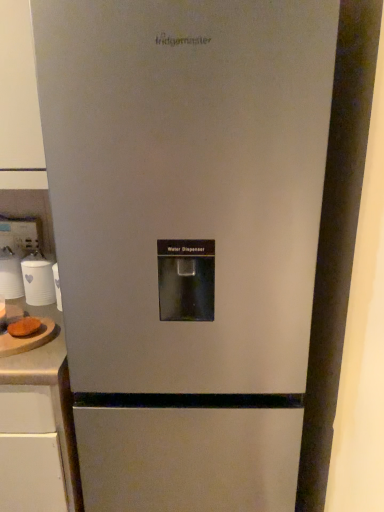
Question: Does white laminate counter at lower left, which ranks as the 2th counter top in top-to-bottom order, have a smaller size compared to white matte cup at left, positioned as the 2th appliance in left-to-right order?

Choices:
 (A) no
 (B) yes

Answer: (A)

Question: From a real-world perspective, is white laminate counter at lower left, which ranks as the 2th counter top in top-to-bottom order, positioned under white matte cup at left, positioned as the 2th appliance in left-to-right order, based on gravity?

Choices:
 (A) no
 (B) yes

Answer: (B)

Question: Does white laminate counter at lower left, marked as the 1th counter top in a bottom-to-top arrangement, lie in front of white matte cup at left, positioned as the 2th appliance in left-to-right order?

Choices:
 (A) no
 (B) yes

Answer: (B)

Question: From a real-world perspective, is white laminate counter at lower left, which ranks as the 2th counter top in top-to-bottom order, positioned over white matte cup at left, which is the first appliance from right to left, based on gravity?

Choices:
 (A) no
 (B) yes

Answer: (A)

Question: Considering the relative positions of white laminate counter at lower left, marked as the 1th counter top in a bottom-to-top arrangement, and white matte cup at left, positioned as the 2th appliance in left-to-right order, in the image provided, is white laminate counter at lower left, marked as the 1th counter top in a bottom-to-top arrangement, to the right of white matte cup at left, positioned as the 2th appliance in left-to-right order, from the viewer's perspective?

Choices:
 (A) no
 (B) yes

Answer: (A)

Question: Visually, is white laminate counter at lower left, marked as the 1th counter top in a bottom-to-top arrangement, positioned to the left or to the right of brown fuzzy bread at left?

Choices:
 (A) right
 (B) left

Answer: (B)

Question: In terms of size, does white laminate counter at lower left, which ranks as the 2th counter top in top-to-bottom order, appear bigger or smaller than brown fuzzy bread at left?

Choices:
 (A) small
 (B) big

Answer: (B)

Question: Considering their positions, is white laminate counter at lower left, marked as the 1th counter top in a bottom-to-top arrangement, located in front of or behind brown fuzzy bread at left?

Choices:
 (A) front
 (B) behind

Answer: (A)

Question: Considering the positions of white laminate counter at lower left, marked as the 1th counter top in a bottom-to-top arrangement, and brown fuzzy bread at left in the image, is white laminate counter at lower left, marked as the 1th counter top in a bottom-to-top arrangement, wider or thinner than brown fuzzy bread at left?

Choices:
 (A) thin
 (B) wide

Answer: (B)

Question: Looking at the image, does brown fuzzy bread at left seem bigger or smaller compared to white laminate counter at lower left, which ranks as the 2th counter top in top-to-bottom order?

Choices:
 (A) small
 (B) big

Answer: (A)

Question: Considering the positions of brown fuzzy bread at left and white laminate counter at lower left, marked as the 1th counter top in a bottom-to-top arrangement, in the image, is brown fuzzy bread at left taller or shorter than white laminate counter at lower left, marked as the 1th counter top in a bottom-to-top arrangement,?

Choices:
 (A) short
 (B) tall

Answer: (A)

Question: In the image, is brown fuzzy bread at left positioned in front of or behind white laminate counter at lower left, marked as the 1th counter top in a bottom-to-top arrangement?

Choices:
 (A) front
 (B) behind

Answer: (B)

Question: Does point (29, 332) appear closer or farther from the camera than point (57, 334)?

Choices:
 (A) farther
 (B) closer

Answer: (B)

Question: Considering the positions of white glossy cups at left, which is the 1th appliance in left-to-right order, and brown fuzzy bread at left in the image, is white glossy cups at left, which is the 1th appliance in left-to-right order, taller or shorter than brown fuzzy bread at left?

Choices:
 (A) tall
 (B) short

Answer: (A)

Question: From a real-world perspective, relative to brown fuzzy bread at left, is white glossy cups at left, marked as the 2th appliance in a right-to-left arrangement, vertically above or below?

Choices:
 (A) above
 (B) below

Answer: (A)